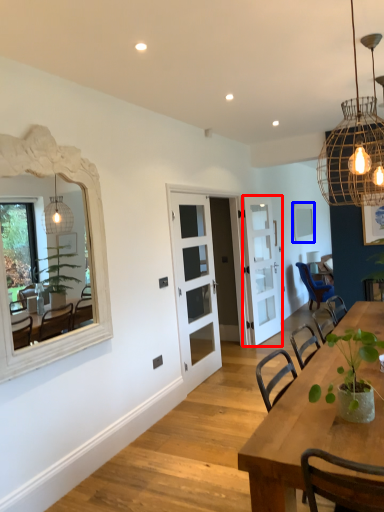
Question: Among these objects, which one is farthest to the camera, door (highlighted by a red box) or mirror (highlighted by a blue box)?

Choices:
 (A) door
 (B) mirror

Answer: (B)